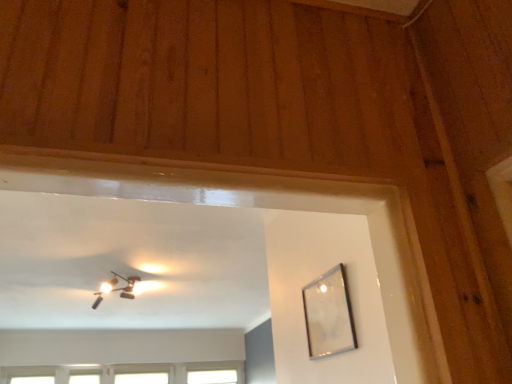
Question: Would you say clear glass window at lower center, acting as the 3th window starting from the left, is to the left or to the right of clear glass picture frame at upper right in the picture?

Choices:
 (A) left
 (B) right

Answer: (A)

Question: From the image's perspective, is clear glass window at lower center, the second window from the right, located above or below clear glass picture frame at upper right?

Choices:
 (A) below
 (B) above

Answer: (A)

Question: Which is nearer to the white glass window at upper center, which ranks as the fourth window in left-to-right order?

Choices:
 (A) matte black fixture at upper center
 (B) clear glass window at lower center, acting as the 3th window starting from the left
 (C) clear glass picture frame at upper right
 (D) transparent glass window at lower left, marked as the fourth window in a right-to-left arrangement
 (E) transparent glass window at lower left, the 2th window when ordered from left to right

Answer: (B)

Question: Estimate the real-world distances between objects in this image. Which object is farther from the transparent glass window at lower left, the 2th window when ordered from left to right?

Choices:
 (A) clear glass picture frame at upper right
 (B) clear glass window at lower center, acting as the 3th window starting from the left
 (C) transparent glass window at lower left, marked as the fourth window in a right-to-left arrangement
 (D) white glass window at upper center, which ranks as the fourth window in left-to-right order
 (E) matte black fixture at upper center

Answer: (A)